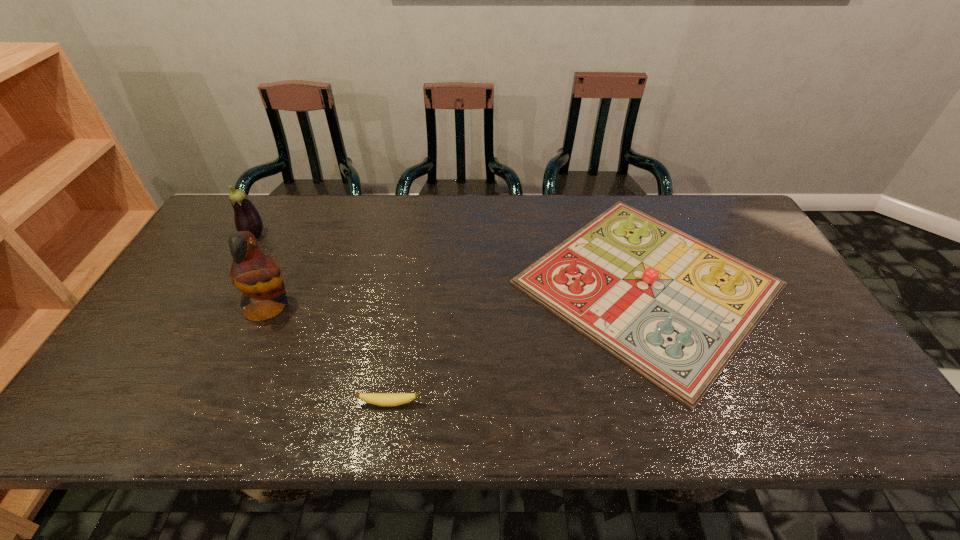
Locate an element on the screen. The image size is (960, 540). free space that satisfies the following two spatial constraints: 1. on the face of the parrot; 2. on the back side of the banana is located at coordinates (226, 403).

Image resolution: width=960 pixels, height=540 pixels. What are the coordinates of `vacant area that satisfies the following two spatial constraints: 1. on the face of the tallest object; 2. on the right side of the banana` in the screenshot? It's located at (226, 403).

I want to click on vacant space that satisfies the following two spatial constraints: 1. on the front side of the second shortest object; 2. on the left side of the leftmost object, so click(227, 284).

This screenshot has width=960, height=540. In order to click on free point that satisfies the following two spatial constraints: 1. on the face of the parrot; 2. on the right side of the shortest object in this screenshot , I will do `click(226, 403)`.